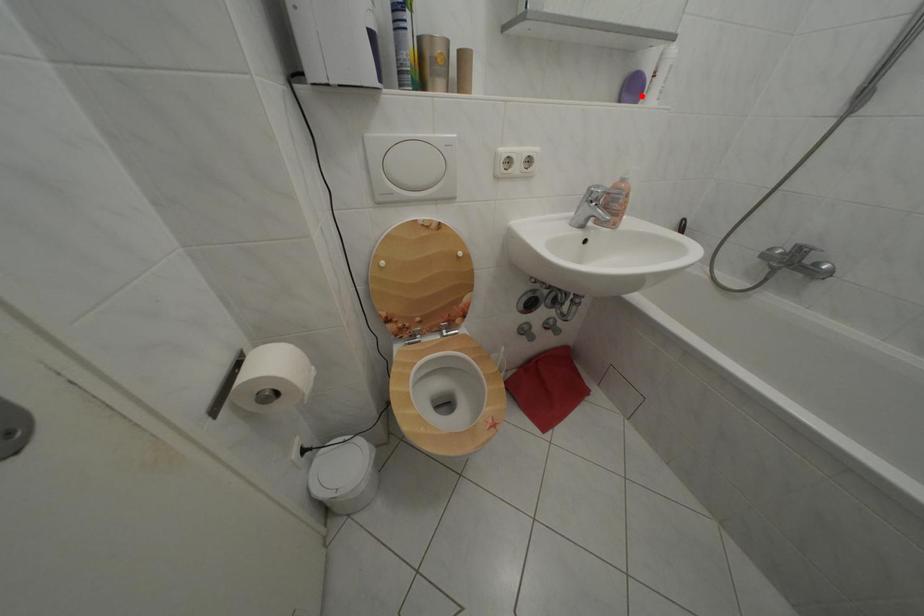
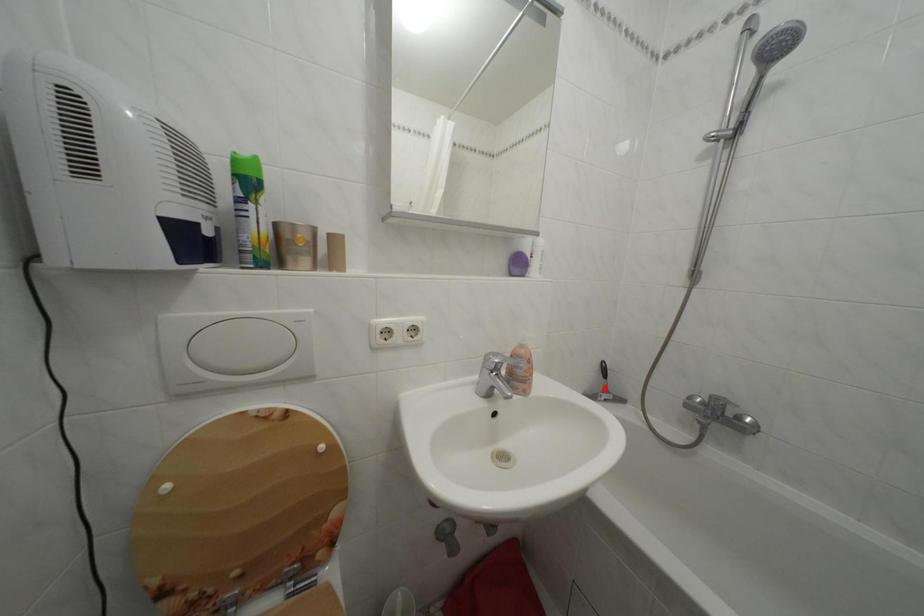
Based on the photo, I am providing you with two images of the same scene from different viewpoints. A red point is marked on the first image and another point is marked on the second image. Is the marked point in image1 the same physical position as the marked point in image2?

No